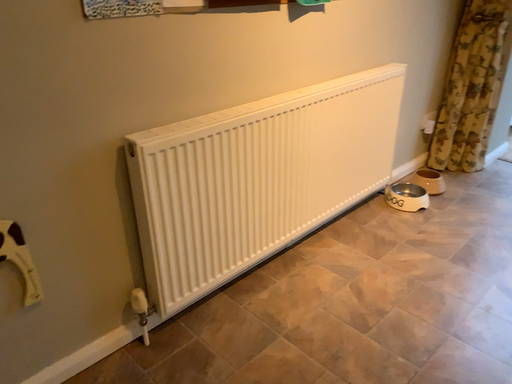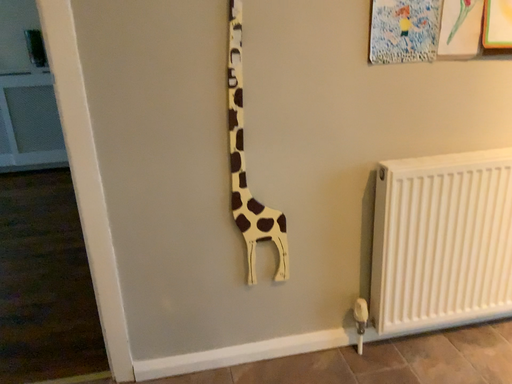
Question: Which way did the camera rotate in the video?

Choices:
 (A) rotated upward
 (B) rotated downward

Answer: (A)